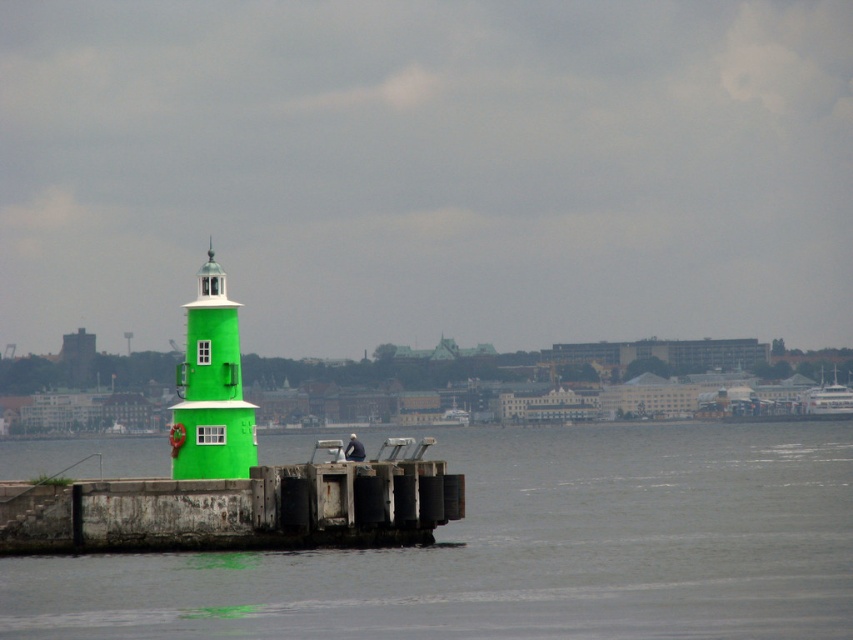
Question: Which point is farther to the camera?

Choices:
 (A) green concrete water at center
 (B) rusty metal dock at center
 (C) white glossy boat at upper right

Answer: (C)

Question: Is green concrete water at center thinner than green matte/lightweight tower at center?

Choices:
 (A) yes
 (B) no

Answer: (B)

Question: Which of the following is the closest to the observer?

Choices:
 (A) (306, 584)
 (B) (225, 538)

Answer: (A)

Question: Is green matte/lightweight tower at center smaller than white glossy boat at upper right?

Choices:
 (A) yes
 (B) no

Answer: (A)

Question: Can you confirm if rusty metal dock at center is thinner than green matte/lightweight tower at center?

Choices:
 (A) no
 (B) yes

Answer: (A)

Question: Among these objects, which one is farthest from the camera?

Choices:
 (A) green concrete water at center
 (B) rusty metal dock at center
 (C) white glossy boat at upper right

Answer: (C)